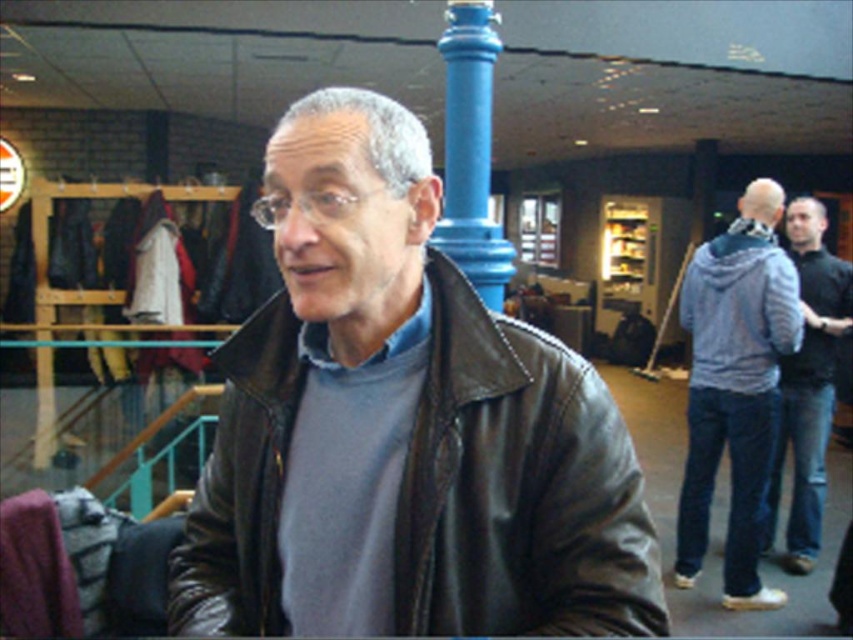
Question: Which of these objects is positioned closest to the light blue hoodie at right?

Choices:
 (A) dark blue jeans at right
 (B) black leather jacket at center

Answer: (A)

Question: Which object is farther from the camera taking this photo?

Choices:
 (A) light blue hoodie at right
 (B) black leather jacket at center
 (C) dark blue jeans at right

Answer: (C)

Question: Can you confirm if light blue hoodie at right is positioned above blue painted metal pole at center?

Choices:
 (A) no
 (B) yes

Answer: (A)

Question: Is black leather jacket at center to the right of light blue hoodie at right from the viewer's perspective?

Choices:
 (A) no
 (B) yes

Answer: (A)

Question: Which point appears closest to the camera in this image?

Choices:
 (A) (590, 518)
 (B) (729, 564)
 (C) (831, 404)
 (D) (489, 182)

Answer: (A)

Question: Observing the image, what is the correct spatial positioning of black leather jacket at center in reference to light blue hoodie at right?

Choices:
 (A) below
 (B) above

Answer: (B)